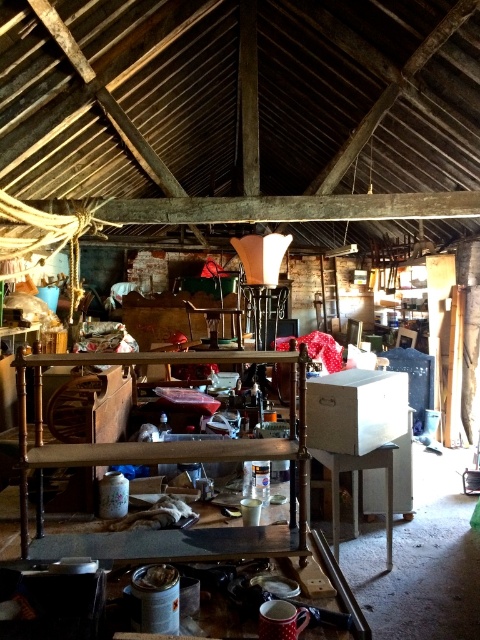
Is wooden shelf at center wider than white glossy table at center?

Indeed, wooden shelf at center has a greater width compared to white glossy table at center.

Is wooden shelf at center positioned at the back of white glossy table at center?

That is False.

Between point (284, 458) and point (388, 483), which one is positioned in front?

Point (284, 458) is more forward.

I want to click on wooden shelf at center, so click(x=160, y=461).